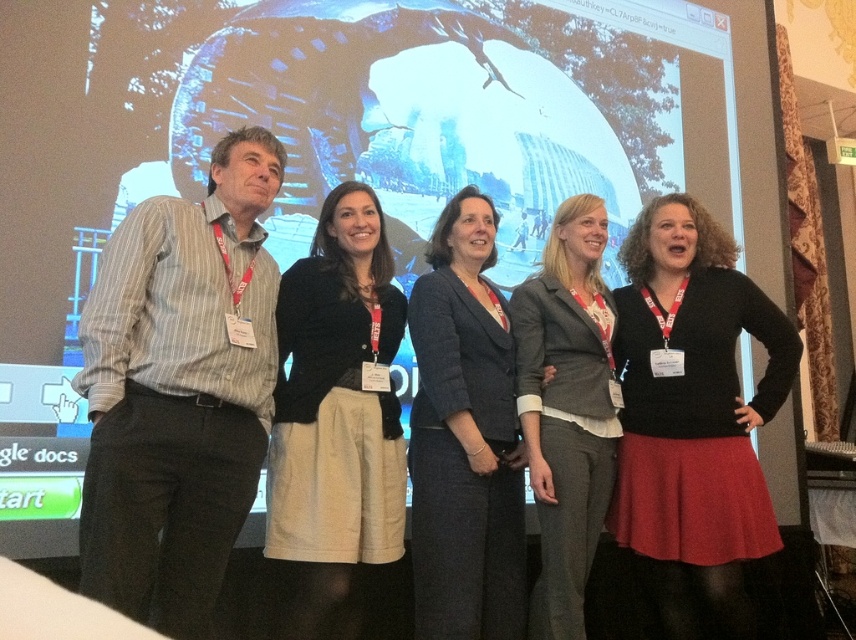
You are an event coordinator and need to place a name tag holder on the black sweater at center. The holder requires a rectangular area of 0.5 units in width and 0.3 units in height. Can the holder fit on the sweater without overlapping other items? Please consider the sweater is at point (693, 416) and the screen is at the back.

The black sweater at center is located at point (693, 416). The rectangular holder of 0.5x0.3 units can fit on the sweater as long as there are no overlapping items within that area. However, since the description does not mention any overlapping objects, it is safe to assume the holder can be placed there.

You are organizing a photo shoot and need to ensure that the striped cotton shirt at left and the dark gray suit at center are spaced exactly 30 inches apart for the composition. Based on the current setup, do you need to adjust their positions?

The striped cotton shirt at left and dark gray suit at center are currently 28.53 inches apart. Since this is less than the required 30 inches, you should move them slightly further apart to achieve the desired spacing.